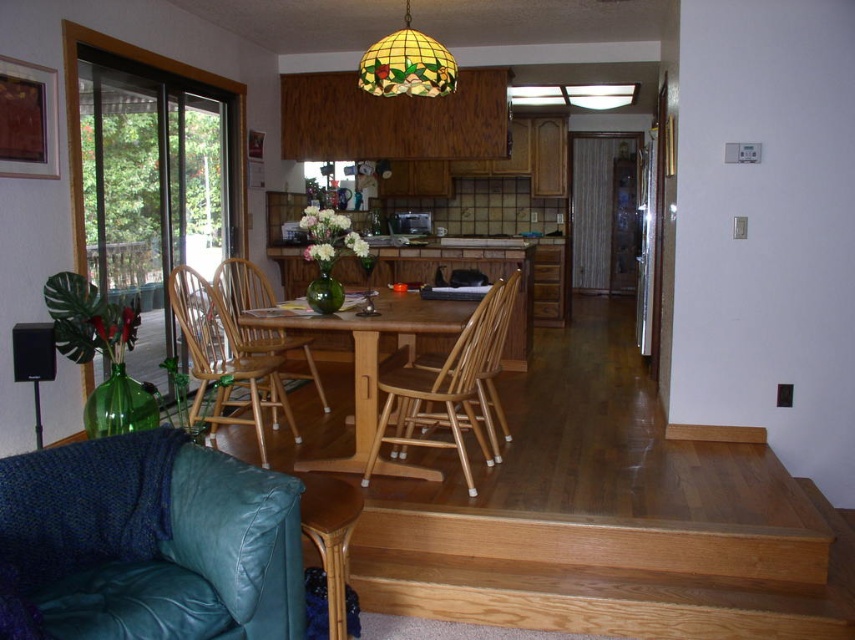
You are planning to place a new rectangular rug under the wooden table at center and the beech wood armchair at center. Which object requires a larger rug to cover its base? Please explain your reasoning based on their sizes.

The beech wood armchair at center requires a larger rug because it is taller than the wooden table at center, so its base might be wider to provide stability.

You are standing in the dining area and want to reach the kitchen counter located at point (413,308). If you can walk 12 feet per minute, how long will it take you to reach the kitchen counter?

The distance to the kitchen counter at point (413,308) is 11.01 feet. At a walking speed of 12 feet per minute, it would take approximately 0.92 minutes, which is about 55 seconds.

You are standing in the dining area and notice the wooden table at center and the stained glass lampshade at upper center. Which object is positioned to the left when viewed from your perspective?

The wooden table at center is to the left of the stained glass lampshade at upper center from your perspective.